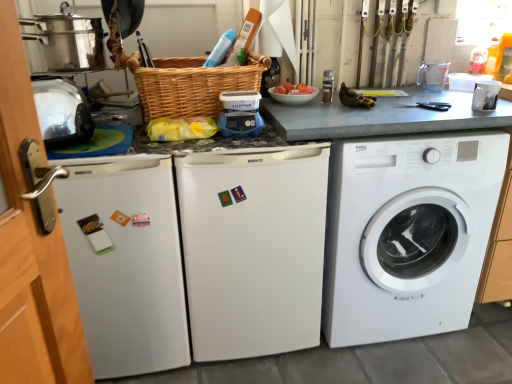
Question: Is white glossy mug at upper right, arranged as the fourth appliance when viewed from the left, to the left of white matte dishwasher at center, which is counted as the first dish washer, starting from the right, from the viewer's perspective?

Choices:
 (A) yes
 (B) no

Answer: (B)

Question: Does white glossy mug at upper right, the 1th appliance positioned from the right, touch white matte dishwasher at center, which is counted as the first dish washer, starting from the right?

Choices:
 (A) yes
 (B) no

Answer: (B)

Question: Is white glossy mug at upper right, the 1th appliance positioned from the right, positioned beyond the bounds of white matte dishwasher at center, which ranks as the second dish washer in left-to-right order?

Choices:
 (A) yes
 (B) no

Answer: (A)

Question: From the image's perspective, is white glossy mug at upper right, the 1th appliance positioned from the right, over white matte dishwasher at center, which is counted as the first dish washer, starting from the right?

Choices:
 (A) no
 (B) yes

Answer: (B)

Question: Can you confirm if white glossy mug at upper right, the 1th appliance positioned from the right, is wider than white matte dishwasher at center, which ranks as the second dish washer in left-to-right order?

Choices:
 (A) yes
 (B) no

Answer: (B)

Question: From the image's perspective, relative to white glossy mug at upper right, arranged as the fourth appliance when viewed from the left, is shiny metallic toaster at left, the 4th appliance in the right-to-left sequence, above or below?

Choices:
 (A) below
 (B) above

Answer: (A)

Question: Looking at their shapes, would you say shiny metallic toaster at left, the 4th appliance in the right-to-left sequence, is wider or thinner than white glossy mug at upper right, arranged as the fourth appliance when viewed from the left?

Choices:
 (A) wide
 (B) thin

Answer: (A)

Question: From a real-world perspective, relative to white glossy mug at upper right, arranged as the fourth appliance when viewed from the left, is shiny metallic toaster at left, which appears as the 1th appliance when viewed from the left, vertically above or below?

Choices:
 (A) above
 (B) below

Answer: (A)

Question: Is shiny metallic toaster at left, the 4th appliance in the right-to-left sequence, spatially inside white glossy mug at upper right, arranged as the fourth appliance when viewed from the left, or outside of it?

Choices:
 (A) outside
 (B) inside

Answer: (A)

Question: In terms of size, does woven brown basket at center appear bigger or smaller than shiny metallic toaster at left, the 4th appliance in the right-to-left sequence?

Choices:
 (A) small
 (B) big

Answer: (B)

Question: Is woven brown basket at center taller or shorter than shiny metallic toaster at left, which appears as the 1th appliance when viewed from the left?

Choices:
 (A) short
 (B) tall

Answer: (A)

Question: From a real-world perspective, is woven brown basket at center positioned above or below shiny metallic toaster at left, which appears as the 1th appliance when viewed from the left?

Choices:
 (A) below
 (B) above

Answer: (B)

Question: Relative to shiny metallic toaster at left, the 4th appliance in the right-to-left sequence, is woven brown basket at center in front or behind?

Choices:
 (A) front
 (B) behind

Answer: (B)

Question: Considering the positions of white glossy mug at upper right, arranged as the fourth appliance when viewed from the left, and shiny metallic toaster at left, which appears as the 1th appliance when viewed from the left, in the image, is white glossy mug at upper right, arranged as the fourth appliance when viewed from the left, wider or thinner than shiny metallic toaster at left, which appears as the 1th appliance when viewed from the left,?

Choices:
 (A) thin
 (B) wide

Answer: (A)

Question: Is white glossy mug at upper right, the 1th appliance positioned from the right, in front of or behind shiny metallic toaster at left, the 4th appliance in the right-to-left sequence, in the image?

Choices:
 (A) front
 (B) behind

Answer: (B)